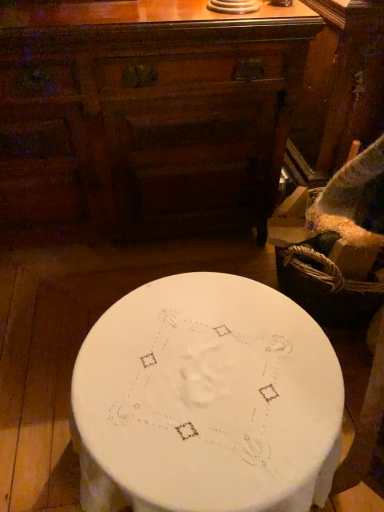
Question: Does matte brown chest of drawers at center appear on the left side of white fabric-covered table at center?

Choices:
 (A) no
 (B) yes

Answer: (B)

Question: Is matte brown chest of drawers at center aimed at white fabric-covered table at center?

Choices:
 (A) yes
 (B) no

Answer: (A)

Question: From the image's perspective, is matte brown chest of drawers at center over white fabric-covered table at center?

Choices:
 (A) yes
 (B) no

Answer: (A)

Question: Is matte brown chest of drawers at center looking in the opposite direction of white fabric-covered table at center?

Choices:
 (A) no
 (B) yes

Answer: (A)

Question: Does matte brown chest of drawers at center have a greater width compared to white fabric-covered table at center?

Choices:
 (A) no
 (B) yes

Answer: (A)

Question: Considering the relative sizes of matte brown chest of drawers at center and white fabric-covered table at center in the image provided, is matte brown chest of drawers at center smaller than white fabric-covered table at center?

Choices:
 (A) yes
 (B) no

Answer: (B)

Question: Can you confirm if white fabric-covered table at center is thinner than matte brown chest of drawers at center?

Choices:
 (A) no
 (B) yes

Answer: (A)

Question: Is white fabric-covered table at center far away from matte brown chest of drawers at center?

Choices:
 (A) no
 (B) yes

Answer: (A)

Question: Does white fabric-covered table at center come in front of matte brown chest of drawers at center?

Choices:
 (A) no
 (B) yes

Answer: (B)

Question: Is white fabric-covered table at center further to the viewer compared to matte brown chest of drawers at center?

Choices:
 (A) no
 (B) yes

Answer: (A)

Question: Is white fabric-covered table at center taller than matte brown chest of drawers at center?

Choices:
 (A) no
 (B) yes

Answer: (A)

Question: From the image's perspective, is white fabric-covered table at center over matte brown chest of drawers at center?

Choices:
 (A) no
 (B) yes

Answer: (A)

Question: Looking at their shapes, would you say matte brown chest of drawers at center is wider or thinner than white fabric-covered table at center?

Choices:
 (A) thin
 (B) wide

Answer: (A)